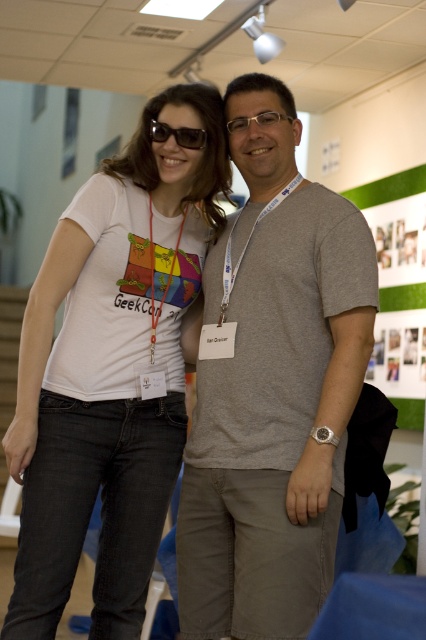
Can you confirm if white cotton t-shirt at center is bigger than gray cotton t-shirt at center?

Correct, white cotton t-shirt at center is larger in size than gray cotton t-shirt at center.

Is white cotton t-shirt at center thinner than gray cotton t-shirt at center?

Incorrect, white cotton t-shirt at center's width is not less than gray cotton t-shirt at center's.

Is point (91, 291) more distant than point (365, 292)?

Yes, point (91, 291) is behind point (365, 292).

Locate an element on the screen. The image size is (426, 640). white cotton t-shirt at center is located at coordinates (112, 369).

Does white cotton t-shirt at center have a greater height compared to black plastic sunglasses at upper center?

Yes.

Measure the distance from white cotton t-shirt at center to black plastic sunglasses at upper center.

white cotton t-shirt at center is 27.88 inches from black plastic sunglasses at upper center.

This screenshot has height=640, width=426. Describe the element at coordinates (112, 369) in the screenshot. I see `white cotton t-shirt at center` at that location.

The width and height of the screenshot is (426, 640). I want to click on white cotton t-shirt at center, so click(x=112, y=369).

Does gray cotton t-shirt at center come in front of black plastic sunglasses at upper center?

Yes, gray cotton t-shirt at center is in front of black plastic sunglasses at upper center.

Who is shorter, gray cotton t-shirt at center or black plastic sunglasses at upper center?

Standing shorter between the two is black plastic sunglasses at upper center.

Is point (299, 573) positioned after point (175, 129)?

No, it is not.

Identify the location of gray cotton t-shirt at center. (273, 387).